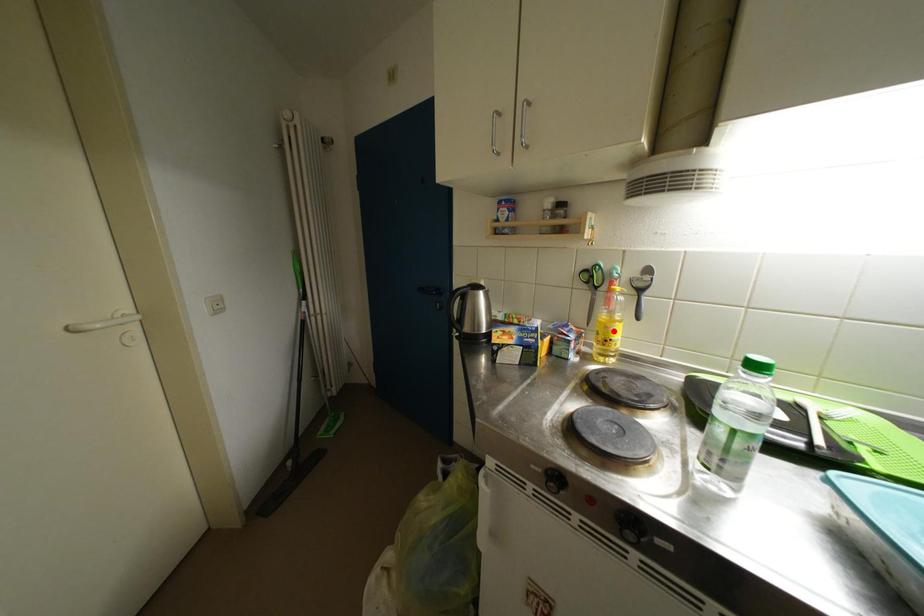
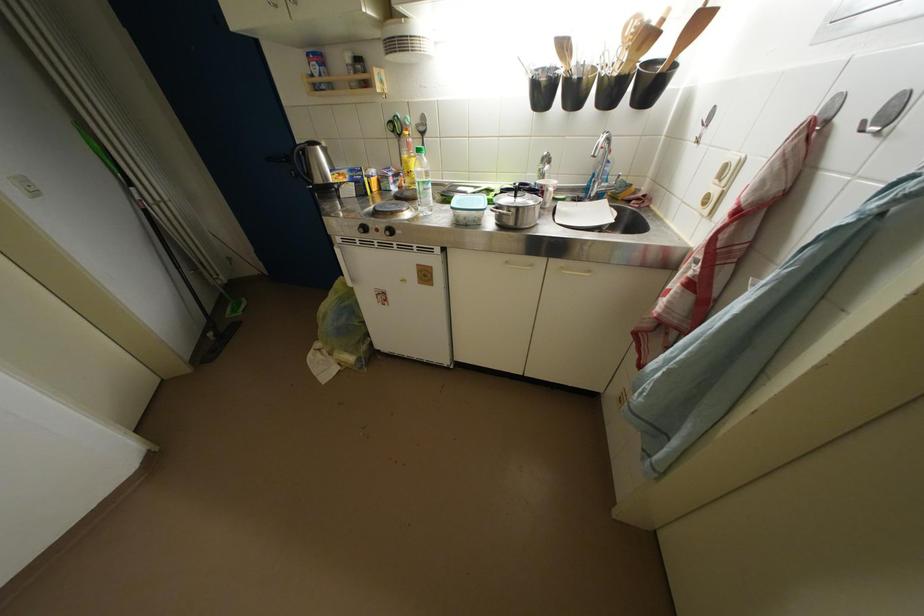
The point at the highlighted location is marked in the first image. Where is the corresponding point in the second image?

(412, 167)